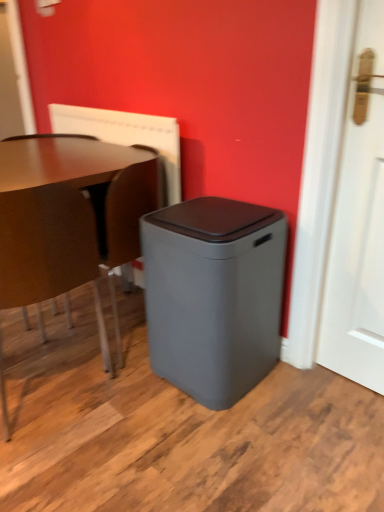
Identify the location of vacant area that is in front of brown leather swivel chair at lower left. The image size is (384, 512). (132, 396).